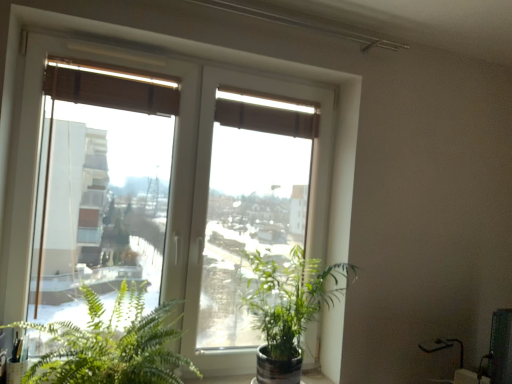
Locate an element on the screen. The height and width of the screenshot is (384, 512). free space above brown fabric curtain at upper center (from a real-world perspective) is located at coordinates (270, 91).